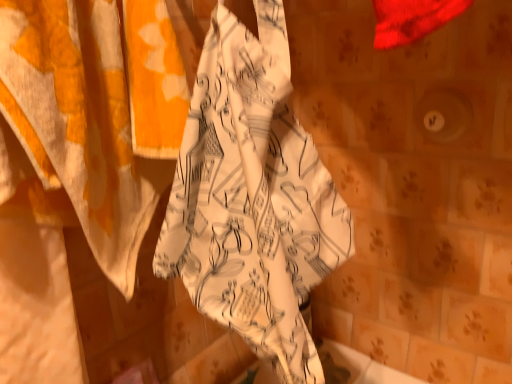
Describe the element at coordinates (92, 114) in the screenshot. I see `white printed fabric at left` at that location.

Find the location of `white printed fabric at left`. white printed fabric at left is located at coordinates click(x=92, y=114).

What is the approximate width of white printed fabric at left?

The width of white printed fabric at left is 5.16 inches.

Locate an element on the screen. This screenshot has height=384, width=512. white printed towel at center is located at coordinates (252, 197).

What is the approximate height of white printed towel at center?

It is 41.92 centimeters.

What do you see at coordinates (252, 197) in the screenshot? This screenshot has height=384, width=512. I see `white printed towel at center` at bounding box center [252, 197].

Locate an element on the screen. The height and width of the screenshot is (384, 512). white printed fabric at left is located at coordinates (92, 114).

Is white printed fabric at left at the left side of white printed towel at center?

Yes, white printed fabric at left is to the left of white printed towel at center.

Is the position of white printed fabric at left less distant than that of white printed towel at center?

Yes, the depth of white printed fabric at left is less than that of white printed towel at center.

Considering the points (12, 158) and (278, 183), which point is in front, point (12, 158) or point (278, 183)?

The point (12, 158) is in front.

From the image's perspective, would you say white printed fabric at left is shown under white printed towel at center?

Correct, white printed fabric at left appears lower than white printed towel at center in the image.

From a real-world perspective, is white printed fabric at left physically located above or below white printed towel at center?

white printed fabric at left is situated higher than white printed towel at center in the real world.

Is white printed fabric at left wider or thinner than white printed towel at center?

Considering their sizes, white printed fabric at left looks slimmer than white printed towel at center.

Is white printed fabric at left taller or shorter than white printed towel at center?

In the image, white printed fabric at left appears to be taller than white printed towel at center.

Which of these two, white printed fabric at left or white printed towel at center, is smaller?

white printed towel at center is smaller.

Can white printed towel at center be found inside white printed fabric at left?

No, white printed towel at center is not inside white printed fabric at left.

Can you see white printed fabric at left touching white printed towel at center?

No, white printed fabric at left is not in contact with white printed towel at center.

Looking at this image, could you tell me if white printed fabric at left is facing white printed towel at center?

Yes, white printed fabric at left faces towards white printed towel at center.

Identify the location of curtain lying below the white printed towel at center (from the image's perspective). (92, 114).

Can you confirm if white printed towel at center is positioned to the right of white printed fabric at left?

Yes.

Considering the positions of objects white printed towel at center and white printed fabric at left in the image provided, who is behind, white printed towel at center or white printed fabric at left?

white printed towel at center is behind.

Which point is more distant from viewer, (232, 156) or (63, 159)?

The point (232, 156) is farther.

From the image's perspective, which is below, white printed towel at center or white printed fabric at left?

white printed fabric at left, from the image's perspective.

From a real-world perspective, is white printed towel at center over white printed fabric at left?

No, from a real-world perspective, white printed towel at center is not on top of white printed fabric at left.

Is white printed towel at center thinner than white printed fabric at left?

No, white printed towel at center is not thinner than white printed fabric at left.

From their relative heights in the image, would you say white printed towel at center is taller or shorter than white printed fabric at left?

Considering their sizes, white printed towel at center has less height than white printed fabric at left.

Which of these two, white printed towel at center or white printed fabric at left, is smaller?

white printed towel at center is smaller.

Is white printed towel at center not inside white printed fabric at left?

Yes, white printed towel at center is not within white printed fabric at left.

From the picture: Is white printed towel at center in contact with white printed fabric at left?

white printed towel at center and white printed fabric at left are clearly separated.

Could you tell me if white printed towel at center is facing white printed fabric at left?

No, white printed towel at center is not facing towards white printed fabric at left.

Can you tell me how much white printed towel at center and white printed fabric at left differ in facing direction?

96.3 degrees.

How far apart are white printed towel at center and white printed fabric at left?

7.03 inches.

The width and height of the screenshot is (512, 384). Identify the location of curtain that appears on the left of white printed towel at center. (92, 114).

Where is `curtain in front of the white printed towel at center`? The width and height of the screenshot is (512, 384). curtain in front of the white printed towel at center is located at coordinates (92, 114).

The height and width of the screenshot is (384, 512). I want to click on curtain above the white printed towel at center (from a real-world perspective), so click(92, 114).